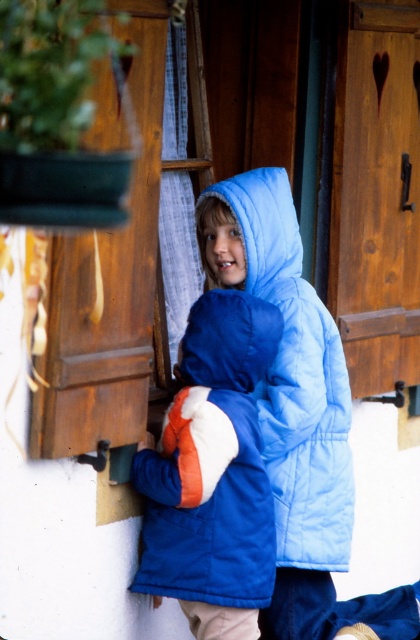
Question: From the image, what is the correct spatial relationship of blue quilted jacket at center in relation to blue fleece hood at center?

Choices:
 (A) right
 (B) left

Answer: (B)

Question: Which object is the closest to the blue fleece hood at center?

Choices:
 (A) blue quilted jacket at center
 (B) light blue quilted jacket at center

Answer: (B)

Question: From the image, what is the correct spatial relationship of blue quilted jacket at center in relation to blue fleece hood at center?

Choices:
 (A) left
 (B) right

Answer: (A)

Question: Is light blue quilted jacket at center smaller than blue fleece hood at center?

Choices:
 (A) no
 (B) yes

Answer: (A)

Question: Which point is closer to the camera taking this photo?

Choices:
 (A) (189, 561)
 (B) (319, 355)

Answer: (A)

Question: Which point appears closest to the camera in this image?

Choices:
 (A) (262, 216)
 (B) (204, 456)
 (C) (299, 337)

Answer: (B)